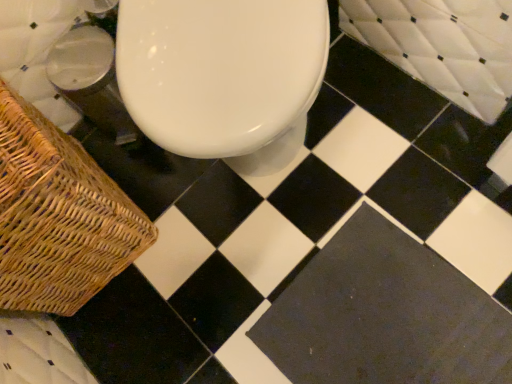
Question: In the image, is black matte tile at center on the left side or the right side of woven brown picnic basket at lower left?

Choices:
 (A) right
 (B) left

Answer: (A)

Question: Is black matte tile at center taller or shorter than woven brown picnic basket at lower left?

Choices:
 (A) tall
 (B) short

Answer: (B)

Question: Based on their relative distances, which object is nearer to the woven brown picnic basket at lower left?

Choices:
 (A) black matte tile at center
 (B) white quilted bath at upper right

Answer: (A)

Question: Which object is the closest to the woven brown picnic basket at lower left?

Choices:
 (A) black matte tile at center
 (B) white quilted bath at upper right

Answer: (A)